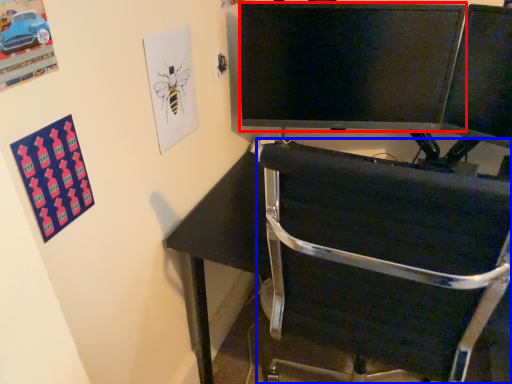
Question: Which object appears farthest to the camera in this image, television (highlighted by a red box) or chair (highlighted by a blue box)?

Choices:
 (A) television
 (B) chair

Answer: (A)